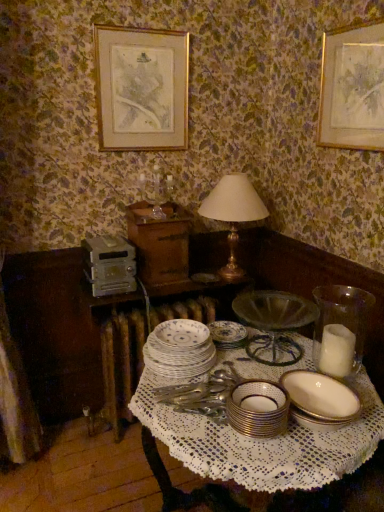
Question: Does porcelain plate at center appear on the right side of clear glass candle holder at upper center?

Choices:
 (A) no
 (B) yes

Answer: (B)

Question: Is porcelain plate at center positioned beyond the bounds of clear glass candle holder at upper center?

Choices:
 (A) yes
 (B) no

Answer: (A)

Question: Is porcelain plate at center beside clear glass candle holder at upper center?

Choices:
 (A) yes
 (B) no

Answer: (B)

Question: Does porcelain plate at center have a larger size compared to clear glass candle holder at upper center?

Choices:
 (A) no
 (B) yes

Answer: (A)

Question: Is porcelain plate at center smaller than clear glass candle holder at upper center?

Choices:
 (A) no
 (B) yes

Answer: (B)

Question: From a real-world perspective, is porcelain plate at center below clear glass candle holder at upper center?

Choices:
 (A) no
 (B) yes

Answer: (B)

Question: Considering the relative sizes of clear glass candle holder at upper center and white porcelain table at center in the image provided, is clear glass candle holder at upper center bigger than white porcelain table at center?

Choices:
 (A) yes
 (B) no

Answer: (B)

Question: Is clear glass candle holder at upper center aimed at white porcelain table at center?

Choices:
 (A) yes
 (B) no

Answer: (B)

Question: Is clear glass candle holder at upper center smaller than white porcelain table at center?

Choices:
 (A) yes
 (B) no

Answer: (A)

Question: Is clear glass candle holder at upper center to the right of white porcelain table at center from the viewer's perspective?

Choices:
 (A) yes
 (B) no

Answer: (B)

Question: Can you confirm if clear glass candle holder at upper center is taller than white porcelain table at center?

Choices:
 (A) yes
 (B) no

Answer: (B)

Question: From a real-world perspective, is clear glass candle holder at upper center located higher than white porcelain table at center?

Choices:
 (A) yes
 (B) no

Answer: (A)

Question: From the image's perspective, is white porcelain plates at center, the third tableware viewed from the right, beneath white porcelain table at center?

Choices:
 (A) yes
 (B) no

Answer: (B)